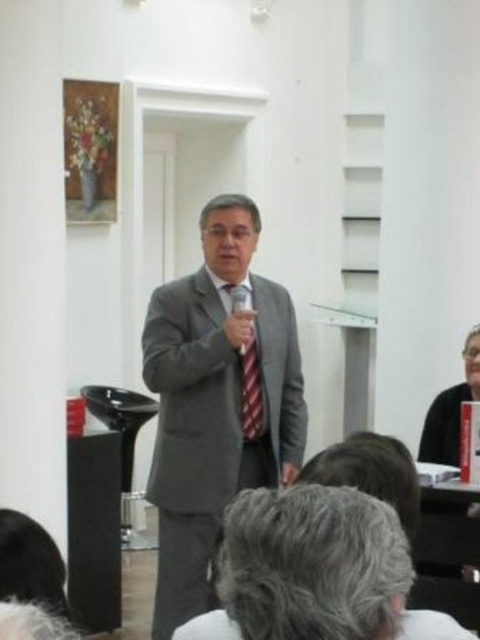
Question: Does gray hair at lower center lie behind black fabric at lower right?

Choices:
 (A) yes
 (B) no

Answer: (B)

Question: Which object is closer to the camera taking this photo?

Choices:
 (A) matte gray suit at center
 (B) red striped tie at center
 (C) black fabric at lower right

Answer: (A)

Question: Is gray hair at lower center closer to camera compared to red striped tie at center?

Choices:
 (A) yes
 (B) no

Answer: (A)

Question: Does gray hair at lower center have a smaller size compared to red striped tie at center?

Choices:
 (A) no
 (B) yes

Answer: (B)

Question: Which object appears closest to the camera in this image?

Choices:
 (A) matte gray suit at center
 (B) red striped tie at center
 (C) gray hair at lower center
 (D) black fabric at lower right

Answer: (C)

Question: Which object is closer to the camera taking this photo?

Choices:
 (A) matte gray suit at center
 (B) black fabric at lower right

Answer: (A)